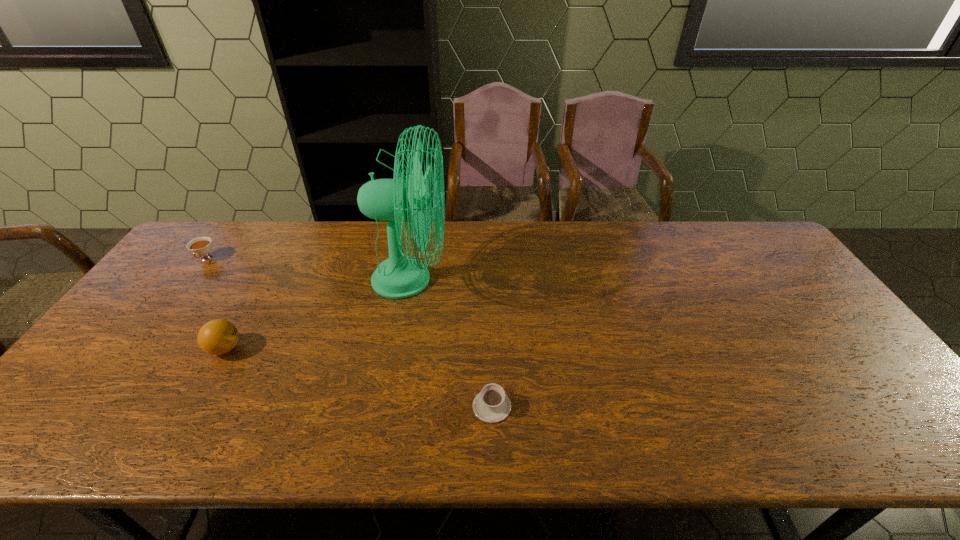
Where is `the third object from left to right`? the third object from left to right is located at coordinates (400, 276).

The height and width of the screenshot is (540, 960). What are the coordinates of `fan` in the screenshot? It's located at (400, 276).

The image size is (960, 540). I want to click on the third farthest object, so click(216, 337).

Find the location of `the third object from right to left`. the third object from right to left is located at coordinates (216, 337).

This screenshot has width=960, height=540. In order to click on the taller teacup in this screenshot , I will do `click(201, 246)`.

This screenshot has height=540, width=960. In order to click on the farther teacup in this screenshot , I will do `click(201, 246)`.

The width and height of the screenshot is (960, 540). I want to click on the rightmost object, so click(491, 405).

Find the location of a particular element. The height and width of the screenshot is (540, 960). the nearest object is located at coordinates (491, 405).

Locate an element on the screen. free space located 0.310m in front of the fan to blow air is located at coordinates (549, 280).

Locate an element on the screen. The width and height of the screenshot is (960, 540). vacant space located 0.080m on the side with brand of the third farthest object is located at coordinates (273, 349).